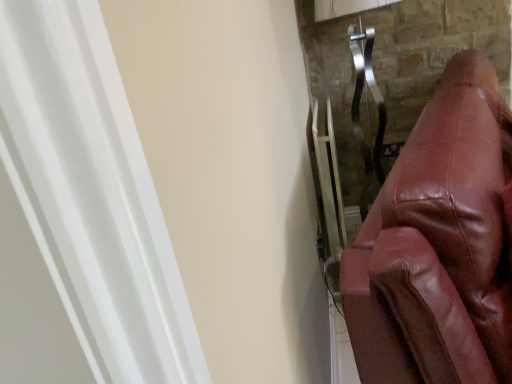
Question: Should I look upward or downward to see shiny brown leather couch at right?

Choices:
 (A) up
 (B) down

Answer: (B)